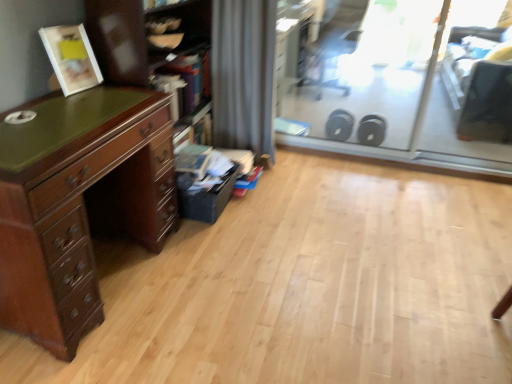
What do you see at coordinates (71, 58) in the screenshot? This screenshot has height=384, width=512. I see `matte white picture frame at upper left` at bounding box center [71, 58].

The height and width of the screenshot is (384, 512). Find the location of `gray fabric curtain at center`. gray fabric curtain at center is located at coordinates (243, 74).

In order to click on wooden bookshelf at left in this screenshot , I will do `click(145, 40)`.

This screenshot has width=512, height=384. I want to click on transparent glass screen door at upper right, the first screen door positioned from the left, so click(x=387, y=93).

How far apart are mahogany wood chest of drawers at left and wooden bookshelf at left?

A distance of 36.39 inches exists between mahogany wood chest of drawers at left and wooden bookshelf at left.

From a real-world perspective, relative to wooden bookshelf at left, is mahogany wood chest of drawers at left vertically above or below?

mahogany wood chest of drawers at left is situated lower than wooden bookshelf at left in the real world.

Considering the relative positions of mahogany wood chest of drawers at left and wooden bookshelf at left in the image provided, is mahogany wood chest of drawers at left to the right of wooden bookshelf at left from the viewer's perspective?

No.

From the image's perspective, who appears lower, mahogany wood chest of drawers at left or wooden bookshelf at left?

mahogany wood chest of drawers at left.

From the image's perspective, between transparent plastic screen door at upper right, which is the second screen door from left to right, and matte white picture frame at upper left, which one is located above?

From the image's view, transparent plastic screen door at upper right, which is the second screen door from left to right, is above.

Is transparent plastic screen door at upper right, which is the second screen door from left to right, not near matte white picture frame at upper left?

Indeed, transparent plastic screen door at upper right, which is the second screen door from left to right, is not near matte white picture frame at upper left.

In terms of width, does transparent plastic screen door at upper right, acting as the 1th screen door starting from the right, look wider or thinner when compared to matte white picture frame at upper left?

transparent plastic screen door at upper right, acting as the 1th screen door starting from the right, is thinner than matte white picture frame at upper left.

Does transparent plastic screen door at upper right, which is the second screen door from left to right, turn towards matte white picture frame at upper left?

No, transparent plastic screen door at upper right, which is the second screen door from left to right, is not oriented towards matte white picture frame at upper left.

Would you say transparent plastic screen door at upper right, which is the second screen door from left to right, is outside wooden bookshelf at left?

That's correct, transparent plastic screen door at upper right, which is the second screen door from left to right, is outside of wooden bookshelf at left.

In the scene shown: From the image's perspective, is transparent plastic screen door at upper right, acting as the 1th screen door starting from the right, above wooden bookshelf at left?

Yes, from the image's perspective, transparent plastic screen door at upper right, acting as the 1th screen door starting from the right, is over wooden bookshelf at left.

Who is bigger, transparent plastic screen door at upper right, acting as the 1th screen door starting from the right, or wooden bookshelf at left?

With larger size is wooden bookshelf at left.

From a real-world perspective, is transparent plastic screen door at upper right, acting as the 1th screen door starting from the right, physically below wooden bookshelf at left?

No, from a real-world perspective, transparent plastic screen door at upper right, acting as the 1th screen door starting from the right, is not beneath wooden bookshelf at left.

Would you say black plastic swivel chair at upper right is inside or outside transparent glass screen door at upper right, the second screen door when ordered from right to left?

black plastic swivel chair at upper right is located beyond the bounds of transparent glass screen door at upper right, the second screen door when ordered from right to left.

Can you tell me how much black plastic swivel chair at upper right and transparent glass screen door at upper right, the first screen door positioned from the left, differ in facing direction?

They differ by 23.8 degrees in their facing directions.

Does black plastic swivel chair at upper right have a greater height compared to transparent glass screen door at upper right, the second screen door when ordered from right to left?

Answer: No, black plastic swivel chair at upper right is not taller than transparent glass screen door at upper right, the second screen door when ordered from right to left.

Is point (260, 71) closer or farther from the camera than point (113, 67)?

Point (260, 71) appears to be farther away from the viewer than point (113, 67).

Is gray fabric curtain at center positioned in front of wooden bookshelf at left?

No, it is not.

Is gray fabric curtain at center bigger or smaller than wooden bookshelf at left?

In the image, gray fabric curtain at center appears to be smaller than wooden bookshelf at left.

Is gray fabric curtain at center far from wooden bookshelf at left?

No, gray fabric curtain at center is not far away from wooden bookshelf at left.

From the image's perspective, is gray fabric curtain at center above or below matte white picture frame at upper left?

From the image's perspective, gray fabric curtain at center appears above matte white picture frame at upper left.

From their relative heights in the image, would you say gray fabric curtain at center is taller or shorter than matte white picture frame at upper left?

In the image, gray fabric curtain at center appears to be taller than matte white picture frame at upper left.

Could you tell me if gray fabric curtain at center is facing matte white picture frame at upper left?

No, gray fabric curtain at center is not aimed at matte white picture frame at upper left.

Is gray fabric curtain at center at the left side of matte white picture frame at upper left?

No.

Who is more distant, black plastic swivel chair at upper right or matte white picture frame at upper left?

Positioned behind is black plastic swivel chair at upper right.

Would you say black plastic swivel chair at upper right contains matte white picture frame at upper left?

No, black plastic swivel chair at upper right does not contain matte white picture frame at upper left.

Looking at their sizes, would you say black plastic swivel chair at upper right is wider or thinner than matte white picture frame at upper left?

A: In the image, black plastic swivel chair at upper right appears to be wider than matte white picture frame at upper left.

This screenshot has height=384, width=512. Find the location of `bookshelf lying above the mahogany wood chest of drawers at left (from the image's perspective)`. bookshelf lying above the mahogany wood chest of drawers at left (from the image's perspective) is located at coordinates (145, 40).

At what (x,y) coordinates should I click in order to perform the action: click on picture frame lying on the left of transparent plastic screen door at upper right, which is the second screen door from left to right. Please return your answer as a coordinate pair (x, y). Looking at the image, I should click on (71, 58).

Which object lies further to the anchor point transparent plastic screen door at upper right, acting as the 1th screen door starting from the right, mahogany wood chest of drawers at left or transparent glass screen door at upper right, the first screen door positioned from the left?

The object further to transparent plastic screen door at upper right, acting as the 1th screen door starting from the right, is mahogany wood chest of drawers at left.

Which object lies nearer to the anchor point transparent glass screen door at upper right, the second screen door when ordered from right to left, transparent plastic screen door at upper right, acting as the 1th screen door starting from the right, or black plastic swivel chair at upper right?

transparent plastic screen door at upper right, acting as the 1th screen door starting from the right, is closer to transparent glass screen door at upper right, the second screen door when ordered from right to left.

Based on their spatial positions, is black plastic swivel chair at upper right or transparent glass screen door at upper right, the first screen door positioned from the left, closer to transparent plastic screen door at upper right, acting as the 1th screen door starting from the right?

transparent glass screen door at upper right, the first screen door positioned from the left, lies closer to transparent plastic screen door at upper right, acting as the 1th screen door starting from the right, than the other object.

Looking at the image, which one is located further to transparent plastic screen door at upper right, acting as the 1th screen door starting from the right, black plastic swivel chair at upper right or wooden bookshelf at left?

Among the two, wooden bookshelf at left is located further to transparent plastic screen door at upper right, acting as the 1th screen door starting from the right.

Considering their positions, is black plastic swivel chair at upper right positioned closer to matte white picture frame at upper left than transparent glass screen door at upper right, the first screen door positioned from the left?

transparent glass screen door at upper right, the first screen door positioned from the left, is positioned closer to the anchor matte white picture frame at upper left.

Looking at the image, which one is located further to transparent plastic screen door at upper right, acting as the 1th screen door starting from the right, black plastic swivel chair at upper right or matte white picture frame at upper left?

The object further to transparent plastic screen door at upper right, acting as the 1th screen door starting from the right, is matte white picture frame at upper left.

When comparing their distances from matte white picture frame at upper left, does mahogany wood chest of drawers at left or gray fabric curtain at center seem further?

Based on the image, gray fabric curtain at center appears to be further to matte white picture frame at upper left.

Based on their spatial positions, is matte white picture frame at upper left or transparent glass screen door at upper right, the second screen door when ordered from right to left, further from black plastic swivel chair at upper right?

matte white picture frame at upper left.

I want to click on swivel chair between wooden bookshelf at left and transparent plastic screen door at upper right, acting as the 1th screen door starting from the right, from left to right, so click(333, 44).

This screenshot has width=512, height=384. I want to click on curtain between transparent glass screen door at upper right, the second screen door when ordered from right to left, and black plastic swivel chair at upper right from front to back, so click(243, 74).

Locate an element on the screen. The height and width of the screenshot is (384, 512). bookshelf located between mahogany wood chest of drawers at left and transparent plastic screen door at upper right, which is the second screen door from left to right, in the left-right direction is located at coordinates (145, 40).

Find the location of a particular element. screen door situated between mahogany wood chest of drawers at left and transparent plastic screen door at upper right, which is the second screen door from left to right, from left to right is located at coordinates (387, 93).